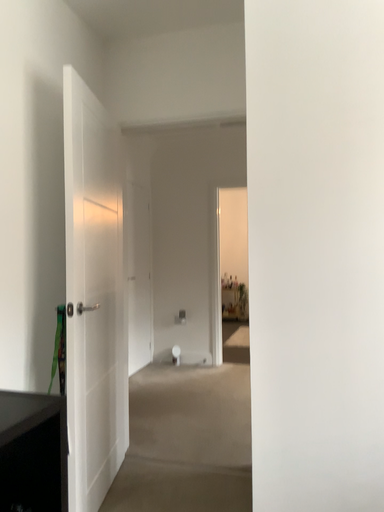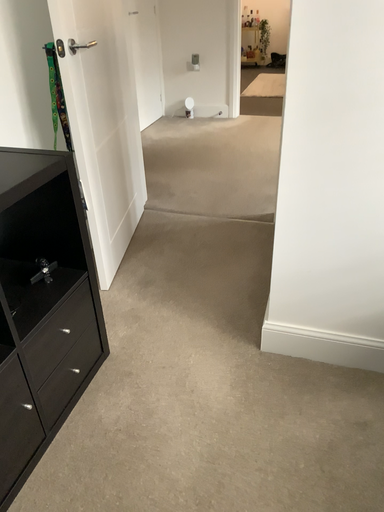
Question: Which way did the camera rotate in the video?

Choices:
 (A) rotated downward
 (B) rotated upward

Answer: (A)